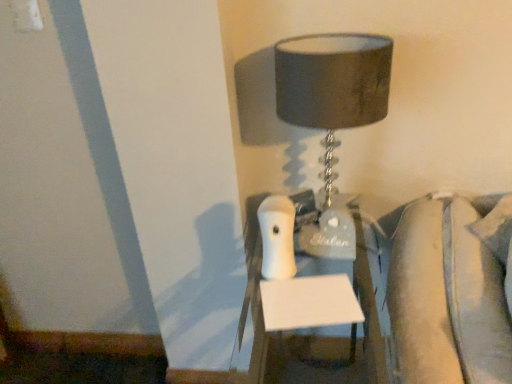
What do you see at coordinates (308, 300) in the screenshot?
I see `white glossy nightstand at center` at bounding box center [308, 300].

Identify the location of white glossy nightstand at center. This screenshot has height=384, width=512. (308, 300).

What do you see at coordinates (332, 111) in the screenshot? The image size is (512, 384). I see `matte gray lampshade at upper center` at bounding box center [332, 111].

In order to click on matte gray lampshade at upper center in this screenshot , I will do `click(332, 111)`.

Find the location of a particular element. white glossy nightstand at center is located at coordinates (308, 300).

From the picture: Considering the positions of objects matte gray lampshade at upper center and white glossy nightstand at center in the image provided, who is more to the left, matte gray lampshade at upper center or white glossy nightstand at center?

matte gray lampshade at upper center.

Between matte gray lampshade at upper center and white glossy nightstand at center, which one is positioned in front?

white glossy nightstand at center is in front.

Which point is more forward, (322, 107) or (369, 350)?

Point (322, 107)

From the image's perspective, between matte gray lampshade at upper center and white glossy nightstand at center, which one is located above?

matte gray lampshade at upper center appears higher in the image.

From a real-world perspective, is matte gray lampshade at upper center on top of white glossy nightstand at center?

Yes, from a real-world perspective, matte gray lampshade at upper center is over white glossy nightstand at center

Which of these two, matte gray lampshade at upper center or white glossy nightstand at center, is wider?

white glossy nightstand at center.

Does matte gray lampshade at upper center have a greater height compared to white glossy nightstand at center?

Incorrect, the height of matte gray lampshade at upper center is not larger of that of white glossy nightstand at center.

Does matte gray lampshade at upper center have a smaller size compared to white glossy nightstand at center?

Correct, matte gray lampshade at upper center occupies less space than white glossy nightstand at center.

Would you say white glossy nightstand at center is part of matte gray lampshade at upper center's contents?

Definitely not — white glossy nightstand at center is not inside matte gray lampshade at upper center.

Is the surface of matte gray lampshade at upper center in direct contact with white glossy nightstand at center?

No, matte gray lampshade at upper center is not making contact with white glossy nightstand at center.

From the picture: Is matte gray lampshade at upper center aimed at white glossy nightstand at center?

No, matte gray lampshade at upper center is not aimed at white glossy nightstand at center.

Looking at this image, can you tell me how much matte gray lampshade at upper center and white glossy nightstand at center differ in facing direction?

There is a 2.73-degree angle between the facing directions of matte gray lampshade at upper center and white glossy nightstand at center.

How much distance is there between matte gray lampshade at upper center and white glossy nightstand at center?

matte gray lampshade at upper center is 18.01 inches from white glossy nightstand at center.

Locate an element on the screen. Image resolution: width=512 pixels, height=384 pixels. lamp behind the white glossy nightstand at center is located at coordinates (332, 111).

Which object is positioned more to the right, white glossy nightstand at center or matte gray lampshade at upper center?

white glossy nightstand at center is more to the right.

Is white glossy nightstand at center behind matte gray lampshade at upper center?

No, white glossy nightstand at center is closer to the camera.

Considering the points (358, 380) and (330, 175), which point is in front, point (358, 380) or point (330, 175)?

The point (330, 175) is closer.

From the image's perspective, would you say white glossy nightstand at center is positioned over matte gray lampshade at upper center?

Incorrect, from the image's perspective, white glossy nightstand at center is lower than matte gray lampshade at upper center.

From a real-world perspective, is white glossy nightstand at center beneath matte gray lampshade at upper center?

Yes, from a real-world perspective, white glossy nightstand at center is below matte gray lampshade at upper center.

Can you confirm if white glossy nightstand at center is wider than matte gray lampshade at upper center?

Yes, white glossy nightstand at center is wider than matte gray lampshade at upper center.

Considering the sizes of objects white glossy nightstand at center and matte gray lampshade at upper center in the image provided, who is shorter, white glossy nightstand at center or matte gray lampshade at upper center?

With less height is matte gray lampshade at upper center.

Does white glossy nightstand at center have a larger size compared to matte gray lampshade at upper center?

Correct, white glossy nightstand at center is larger in size than matte gray lampshade at upper center.

Is white glossy nightstand at center completely or partially outside of matte gray lampshade at upper center?

Yes, white glossy nightstand at center is not within matte gray lampshade at upper center.

Can you see white glossy nightstand at center touching matte gray lampshade at upper center?

white glossy nightstand at center and matte gray lampshade at upper center are not in contact.

Is white glossy nightstand at center facing towards matte gray lampshade at upper center?

No, white glossy nightstand at center is not turned towards matte gray lampshade at upper center.

At what (x,y) coordinates should I click in order to perform the action: click on lamp lying on the left of white glossy nightstand at center. Please return your answer as a coordinate pair (x, y). Looking at the image, I should click on (332, 111).

Locate an element on the screen. The image size is (512, 384). lamp that is above the white glossy nightstand at center (from the image's perspective) is located at coordinates (332, 111).

Where is `furniture below the matte gray lampshade at upper center (from the image's perspective)`? furniture below the matte gray lampshade at upper center (from the image's perspective) is located at coordinates (308, 300).